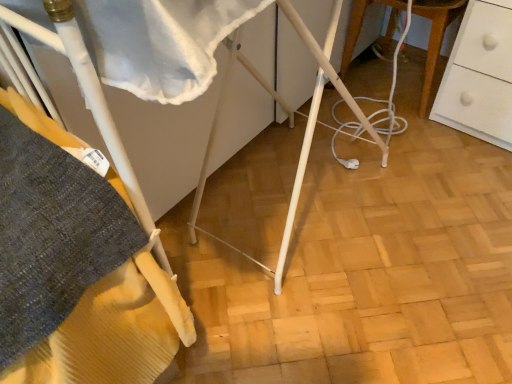
This screenshot has height=384, width=512. Describe the element at coordinates (435, 36) in the screenshot. I see `white wood drawer at right` at that location.

Where is `white wood drawer at right`? The width and height of the screenshot is (512, 384). white wood drawer at right is located at coordinates (435, 36).

You are a GUI agent. You are given a task and a screenshot of the screen. Output one action in this format:
    pyautogui.click(x=<x>, y=<y>)
    Task: Click on the white wood drawer at right
    Image resolution: width=512 pixels, height=384 pixels.
    Given the screenshot: What is the action you would take?
    pyautogui.click(x=435, y=36)